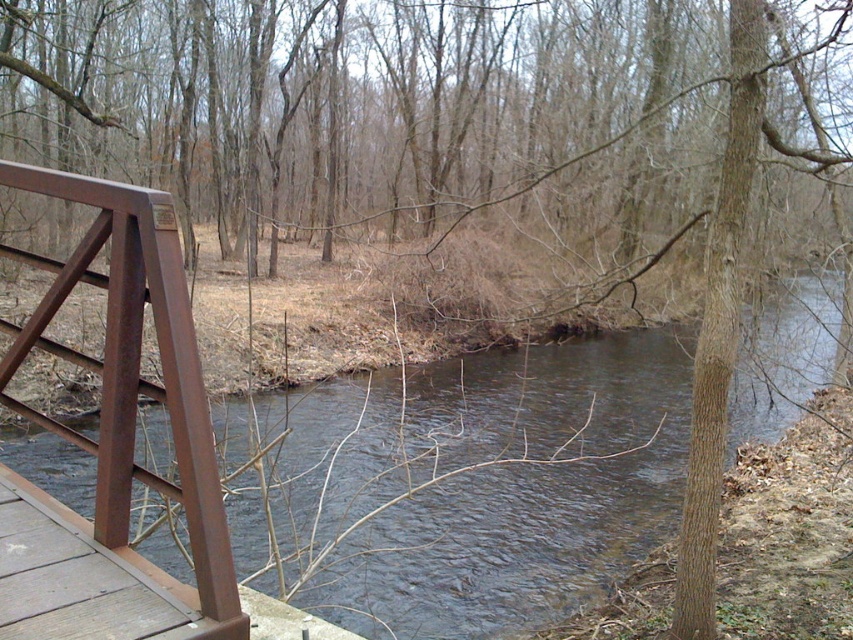
Question: Can you confirm if dark brown water at left is positioned to the left of brown metal/rail at left?

Choices:
 (A) yes
 (B) no

Answer: (B)

Question: Which of the following is the farthest from the observer?

Choices:
 (A) (488, 477)
 (B) (166, 202)

Answer: (A)

Question: Is dark brown water at left to the left of brown metal/rail at left from the viewer's perspective?

Choices:
 (A) no
 (B) yes

Answer: (A)

Question: Can you confirm if dark brown water at left is positioned below brown metal/rail at left?

Choices:
 (A) yes
 (B) no

Answer: (A)

Question: Which point is closer to the camera?

Choices:
 (A) dark brown water at left
 (B) brown metal/rail at left

Answer: (B)